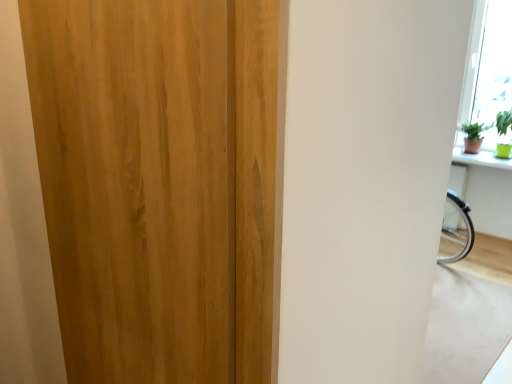
Locate an element on the screen. This screenshot has width=512, height=384. green matte window sill at upper right is located at coordinates (480, 159).

Describe the element at coordinates (480, 159) in the screenshot. I see `green matte window sill at upper right` at that location.

This screenshot has height=384, width=512. Identify the location of wooden door at center. (158, 183).

The image size is (512, 384). Describe the element at coordinates (158, 183) in the screenshot. I see `wooden door at center` at that location.

You are a GUI agent. You are given a task and a screenshot of the screen. Output one action in this format:
    pyautogui.click(x=<x>, y=<y>)
    Task: Click on the green matte window sill at upper right
    The height and width of the screenshot is (384, 512).
    Given the screenshot: What is the action you would take?
    pyautogui.click(x=480, y=159)

Which object is positioned more to the left, green matte window sill at upper right or wooden door at center?

Positioned to the left is wooden door at center.

Which object is closer to the camera taking this photo, green matte window sill at upper right or wooden door at center?

Positioned in front is wooden door at center.

Is point (495, 156) closer or farther from the camera than point (145, 277)?

Point (495, 156) appears to be farther away from the viewer than point (145, 277).

From the image's perspective, is green matte window sill at upper right located beneath wooden door at center?

No, from the image's perspective, green matte window sill at upper right is not beneath wooden door at center.

From a real-world perspective, is green matte window sill at upper right located higher than wooden door at center?

Incorrect, from a real-world perspective, green matte window sill at upper right is lower than wooden door at center.

Considering the sizes of green matte window sill at upper right and wooden door at center in the image, is green matte window sill at upper right wider or thinner than wooden door at center?

Considering their sizes, green matte window sill at upper right looks broader than wooden door at center.

Is green matte window sill at upper right taller or shorter than wooden door at center?

Clearly, green matte window sill at upper right is shorter compared to wooden door at center.

Does green matte window sill at upper right have a larger size compared to wooden door at center?

Actually, green matte window sill at upper right might be smaller than wooden door at center.

Which is correct: green matte window sill at upper right is inside wooden door at center, or outside of it?

green matte window sill at upper right is spatially situated outside wooden door at center.

Can you see green matte window sill at upper right touching wooden door at center?

No, green matte window sill at upper right is not in contact with wooden door at center.

Is wooden door at center at the back of green matte window sill at upper right?

green matte window sill at upper right is not turned away from wooden door at center.

Where is `door that is below the green matte window sill at upper right (from the image's perspective)`? The height and width of the screenshot is (384, 512). door that is below the green matte window sill at upper right (from the image's perspective) is located at coordinates (158, 183).

Can you confirm if wooden door at center is positioned to the left of green matte window sill at upper right?

Indeed, wooden door at center is positioned on the left side of green matte window sill at upper right.

Looking at this image, is wooden door at center in front of or behind green matte window sill at upper right in the image?

Visually, wooden door at center is located in front of green matte window sill at upper right.

Is point (154, 44) positioned after point (458, 155)?

No.

From the image's perspective, is wooden door at center positioned above or below green matte window sill at upper right?

wooden door at center is situated lower than green matte window sill at upper right in the image.

From a real-world perspective, is wooden door at center above or below green matte window sill at upper right?

Clearly, from a real-world perspective, wooden door at center is above green matte window sill at upper right.

Does wooden door at center have a lesser width compared to green matte window sill at upper right?

Yes, wooden door at center is thinner than green matte window sill at upper right.

Consider the image. Considering the sizes of objects wooden door at center and green matte window sill at upper right in the image provided, who is shorter, wooden door at center or green matte window sill at upper right?

green matte window sill at upper right.

Is wooden door at center smaller than green matte window sill at upper right?

No, wooden door at center is not smaller than green matte window sill at upper right.

Can we say wooden door at center lies outside green matte window sill at upper right?

Absolutely, wooden door at center is external to green matte window sill at upper right.

Would you say wooden door at center is a long distance from green matte window sill at upper right?

Absolutely, wooden door at center is distant from green matte window sill at upper right.

Could you tell me if wooden door at center is facing green matte window sill at upper right?

No, wooden door at center is not oriented towards green matte window sill at upper right.

How different are the orientations of wooden door at center and green matte window sill at upper right in degrees?

The angle between the facing direction of wooden door at center and the facing direction of green matte window sill at upper right is 0.974 degrees.

Measure the distance from wooden door at center to green matte window sill at upper right.

wooden door at center and green matte window sill at upper right are 3.48 meters apart from each other.

This screenshot has height=384, width=512. I want to click on door above the green matte window sill at upper right (from a real-world perspective), so click(158, 183).

Find the location of a particular element. window sill on the right of wooden door at center is located at coordinates (480, 159).

At what (x,y) coordinates should I click in order to perform the action: click on door below the green matte window sill at upper right (from the image's perspective). Please return your answer as a coordinate pair (x, y). Looking at the image, I should click on (158, 183).